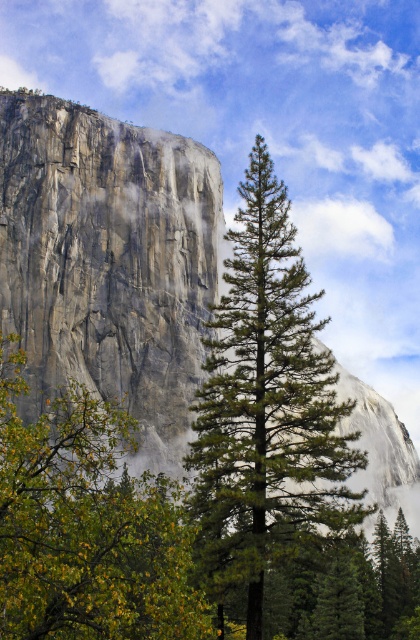
You are a hiker planning to take a photo of the granite cliff face at left and the green leafy tree at center. Which object should you focus on first if you want to capture both in the same frame without moving your camera?

The granite cliff face at left is larger in size than the green leafy tree at center, so you should focus on the granite cliff face at left first to ensure it fills the frame appropriately before adjusting for the smaller tree.

You are a hiker standing at the base of the towering granite cliff and see both the green textured pine tree at center and the green leafy tree at center. Which tree is closer to the cliff face?

The green leafy tree at center is closer to the cliff face because the green textured pine tree at center is positioned above it, meaning the leafy tree is in front.